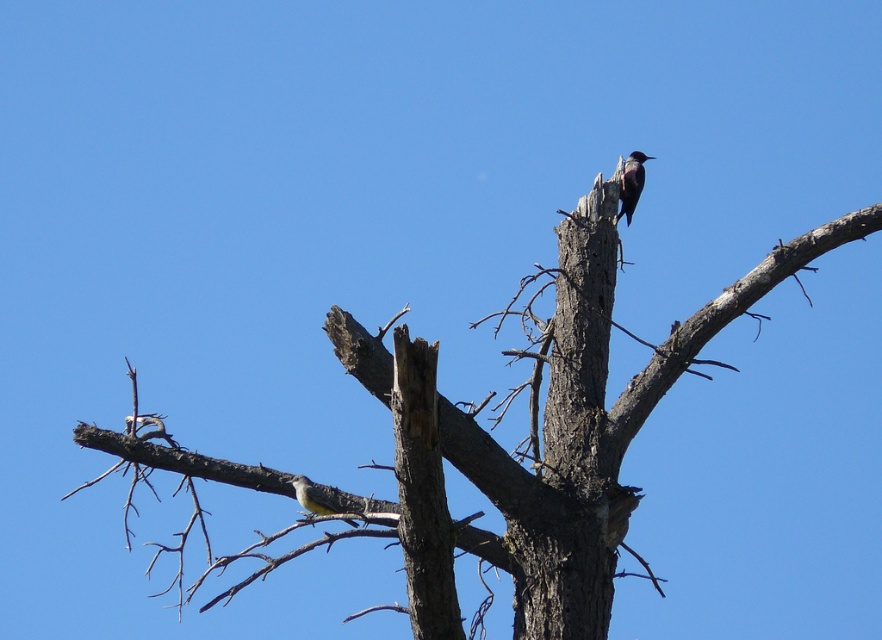
Looking at this image, you are a birdwatcher trying to identify the birds in the image. You notice a shiny black woodpecker at upper right and a smooth bark tree trunk at upper center. Which object is wider in the image?

The smooth bark tree trunk at upper center is wider than the shiny black woodpecker at upper right.

You are standing at the camera position and want to reach the point marked at coordinates point (x=628, y=216). If you have a 30 feet long rope, will it be sufficient to reach that point?

The distance between point (x=628, y=216) and the camera is 33.18 feet. Since the rope is only 30 feet long, it will not be sufficient to reach the point.